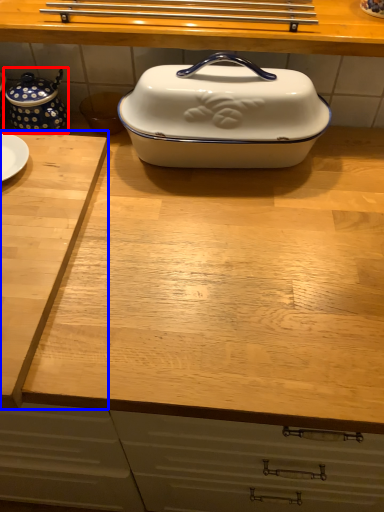
Question: Which object appears closest to the camera in this image, tea pot (highlighted by a red box) or cutting board (highlighted by a blue box)?

Choices:
 (A) tea pot
 (B) cutting board

Answer: (B)